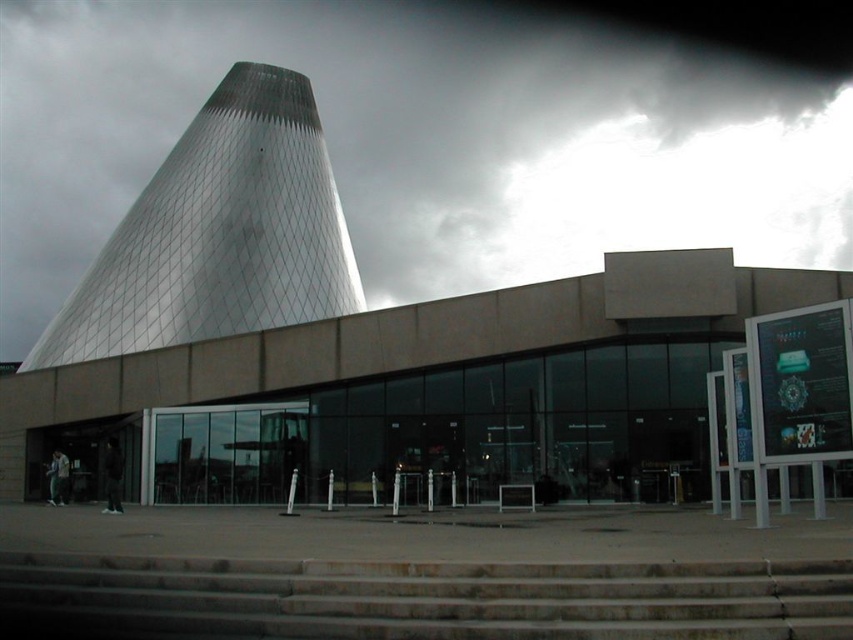
Question: Which point is closer to the camera?

Choices:
 (A) concrete stairs at center
 (B) metallic glass tower at upper left

Answer: (A)

Question: Can you confirm if concrete stairs at center is positioned above metallic glass tower at upper left?

Choices:
 (A) no
 (B) yes

Answer: (A)

Question: Does dark gray textured cone at upper center come in front of concrete stairs at center?

Choices:
 (A) yes
 (B) no

Answer: (B)

Question: Is dark gray textured cone at upper center bigger than metallic glass tower at upper left?

Choices:
 (A) yes
 (B) no

Answer: (A)

Question: Which object is the closest to the metallic glass tower at upper left?

Choices:
 (A) concrete stairs at center
 (B) dark gray textured cone at upper center

Answer: (B)

Question: Which point appears closest to the camera in this image?

Choices:
 (A) (770, 577)
 (B) (700, 74)

Answer: (A)